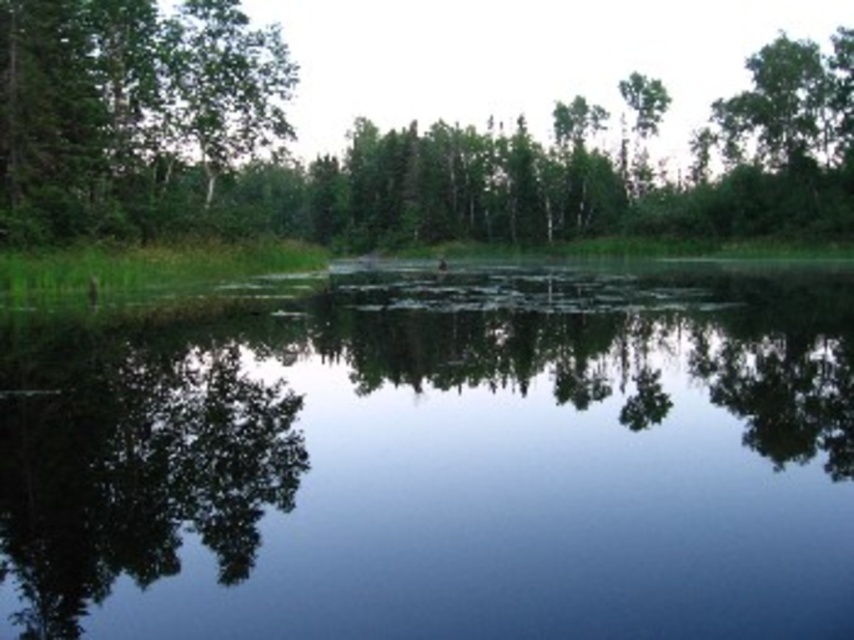
Is green leafy tree at upper center to the right of green matte tree at upper left from the viewer's perspective?

Yes, green leafy tree at upper center is to the right of green matte tree at upper left.

How distant is green leafy tree at upper center from green matte tree at upper left?

They are 20.22 meters apart.

This screenshot has height=640, width=854. What do you see at coordinates (381, 145) in the screenshot? I see `green leafy tree at upper center` at bounding box center [381, 145].

The width and height of the screenshot is (854, 640). What are the coordinates of `green leafy tree at upper center` in the screenshot? It's located at (381, 145).

Is point (89, 536) behind point (835, 138)?

No, (89, 536) is in front of (835, 138).

Measure the distance between transparent water at center and camera.

transparent water at center is 11.53 meters from camera.

Where is `transparent water at center`? This screenshot has width=854, height=640. transparent water at center is located at coordinates (440, 458).

Image resolution: width=854 pixels, height=640 pixels. What are the coordinates of `transparent water at center` in the screenshot? It's located at (440, 458).

How much distance is there between transparent water at center and green matte tree at upper left?

transparent water at center is 26.27 meters away from green matte tree at upper left.

Is point (522, 352) positioned behind point (62, 188)?

No, (522, 352) is closer to viewer.

Is point (89, 362) positioned in front of point (22, 26)?

Yes, it is.

The image size is (854, 640). Find the location of `transparent water at center`. transparent water at center is located at coordinates (440, 458).